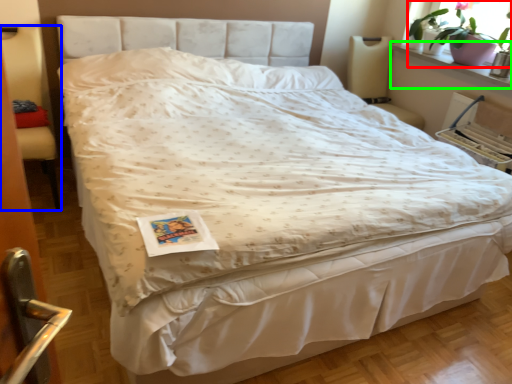
Question: Which is farther away from houseplant (highlighted by a red box)? armchair (highlighted by a blue box) or window sill (highlighted by a green box)?

Choices:
 (A) armchair
 (B) window sill

Answer: (A)